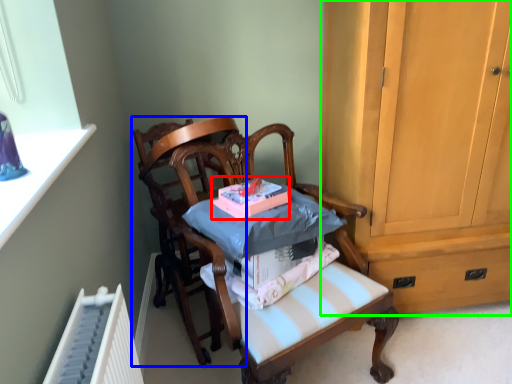
Question: Which object is the farthest from book (highlighted by a red box)? Choose among these: chair (highlighted by a blue box) or cabinetry (highlighted by a green box).

Choices:
 (A) chair
 (B) cabinetry

Answer: (B)